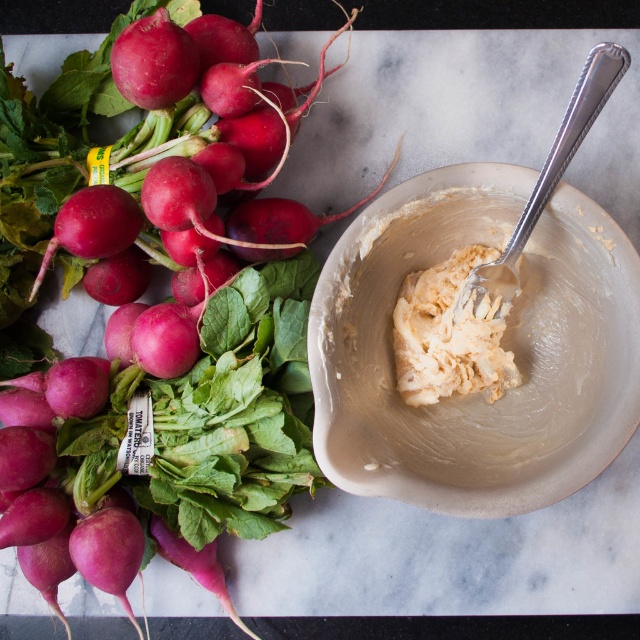
You are standing in a grocery store looking at the smooth red radish at left. If you want to pick it up, will it be easy to reach?

The smooth red radish at left is 36.88 inches away from the viewer, so it is too far to reach without moving closer. You need to step forward or use a tool to get it.

You are a chef preparing a dish and need to spread the white creamy paste at center onto the radishes. The silver textured spoon at upper right is your tool. Can you reach the paste without moving the spoon?

The white creamy paste at center is to the left of the silver textured spoon at upper right, so yes, the chef can reach the paste without moving the spoon by simply moving their hand from the spoon to the left.